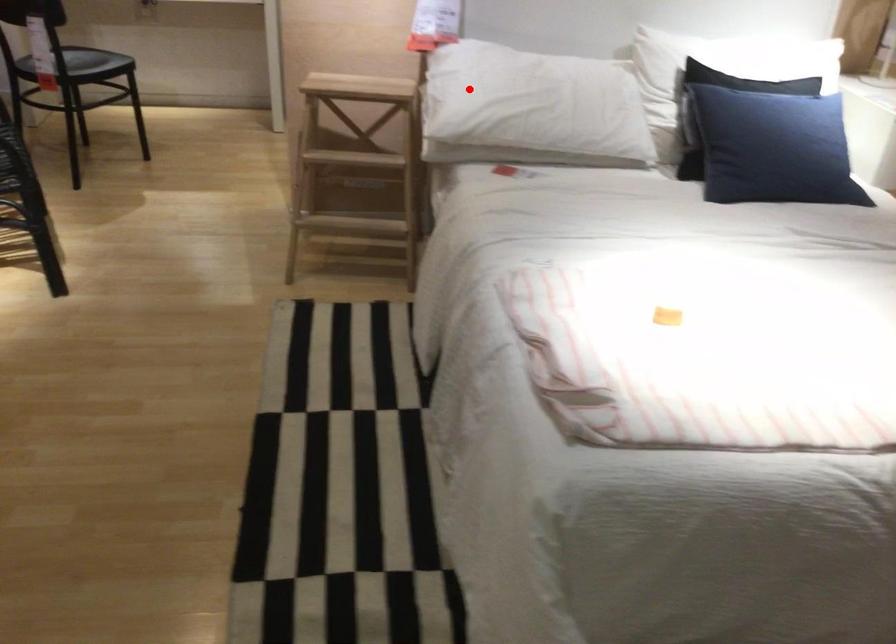
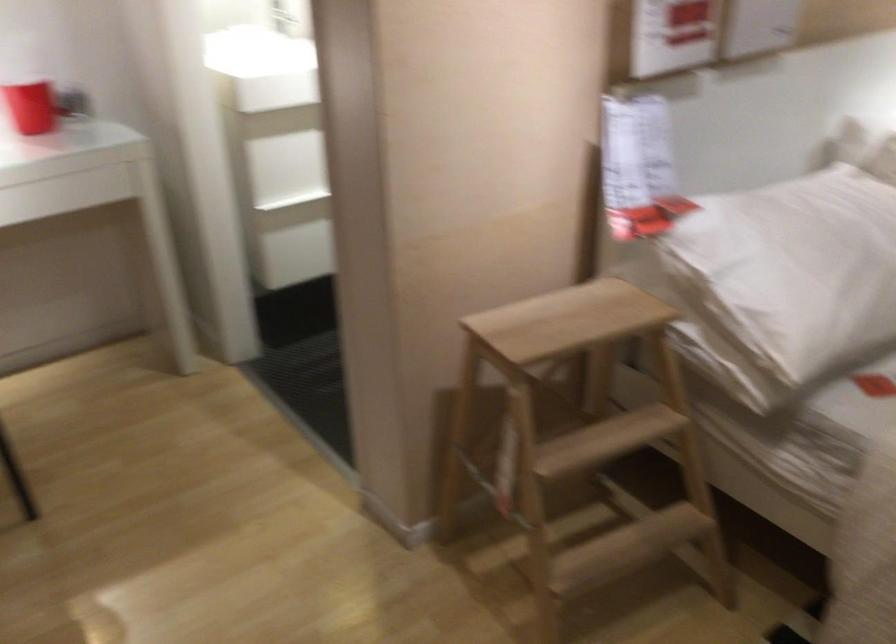
In the second image, find the point that corresponds to the highlighted location in the first image.

(785, 281)